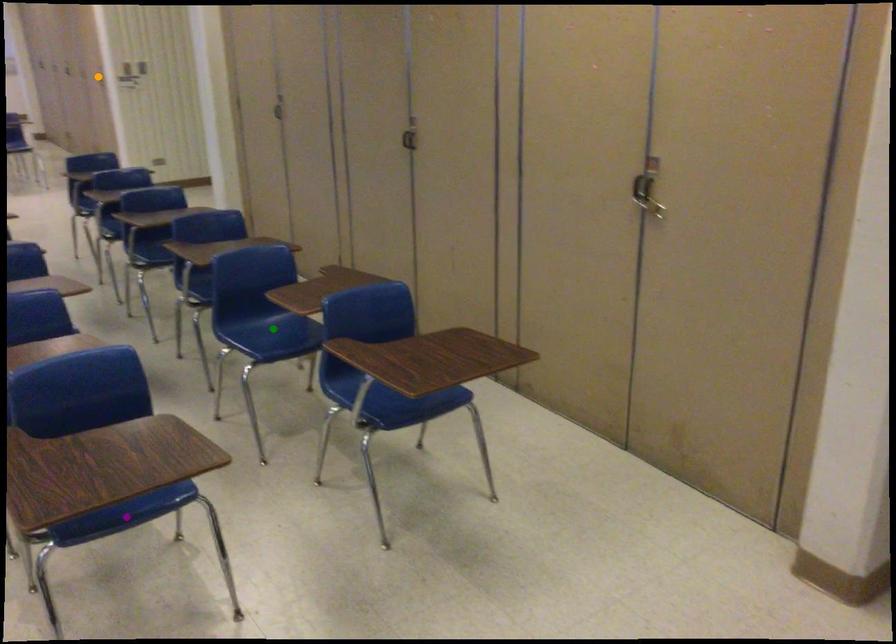
Order these from nearest to farthest:
1. orange point
2. green point
3. purple point

1. orange point
2. green point
3. purple point